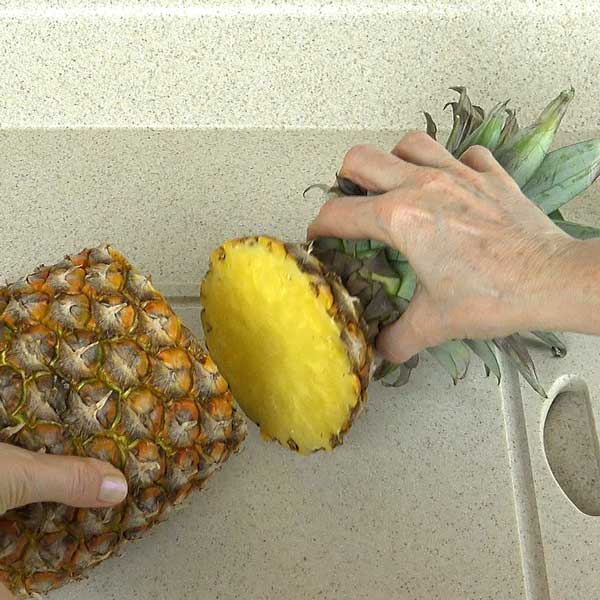
Where is `handle/hole in countertop`? Image resolution: width=600 pixels, height=600 pixels. handle/hole in countertop is located at coordinates (568, 471).